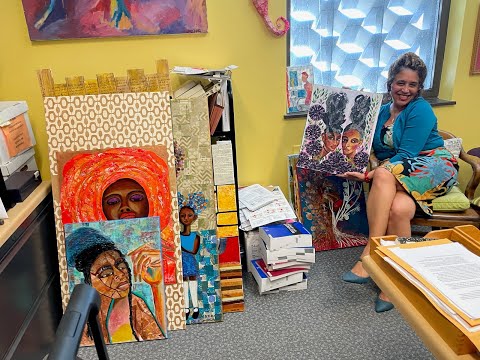
At what (x,y) coordinates should I click in order to perform the action: click on stack of books. Please return your answer as a coordinate pair (x, y). The image size is (480, 360). Looking at the image, I should click on (276, 255).